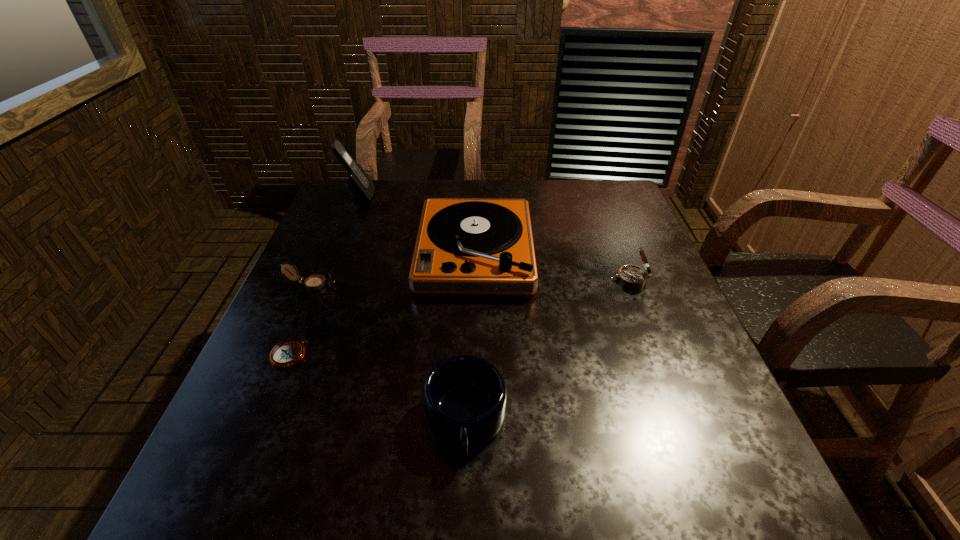
Locate an element on the screen. The height and width of the screenshot is (540, 960). empty space between the second shortest object and the mug is located at coordinates (389, 353).

Locate an element on the screen. Image resolution: width=960 pixels, height=540 pixels. vacant space in between the record player and the tallest object is located at coordinates (417, 224).

Where is `free area in between the shortest object and the record player`? The width and height of the screenshot is (960, 540). free area in between the shortest object and the record player is located at coordinates (382, 303).

The image size is (960, 540). Identify the location of empty location between the record player and the cellular telephone. (x=417, y=224).

Locate which object is the third closest to the record player. Please provide its 2D coordinates. Your answer should be formatted as a tuple, i.e. [(x, y)], where the tuple contains the x and y coordinates of a point satisfying the conditions above.

[(315, 282)]

Identify which object is the fifth closest to the record player. Please provide its 2D coordinates. Your answer should be formatted as a tuple, i.e. [(x, y)], where the tuple contains the x and y coordinates of a point satisfying the conditions above.

[(287, 353)]

Point out which compass is positioned as the nearest to the shortest compass. Please provide its 2D coordinates. Your answer should be formatted as a tuple, i.e. [(x, y)], where the tuple contains the x and y coordinates of a point satisfying the conditions above.

[(315, 282)]

Where is `compass object that ranks as the second closest to the nearest compass`? This screenshot has height=540, width=960. compass object that ranks as the second closest to the nearest compass is located at coordinates (631, 276).

Find the location of a particular element. vacant area that satisfies the following two spatial constraints: 1. on the front-facing side of the tallest object; 2. on the left side of the record player is located at coordinates (335, 252).

This screenshot has height=540, width=960. What are the coordinates of `vacant position in the image that satisfies the following two spatial constraints: 1. with the dial facing the rightmost compass; 2. on the front side of the shortest compass` in the screenshot? It's located at (659, 355).